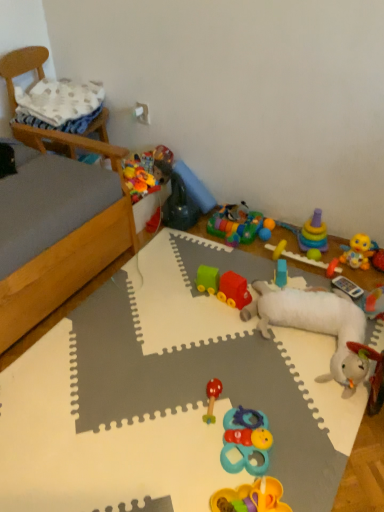
Locate an element on the screen. free area in between blue rubber teething ring at center, positioned as the first toy in bottom-to-top order, and rubberized red mushroom at center, which is counted as the ninth toy, starting from the top is located at coordinates (221, 429).